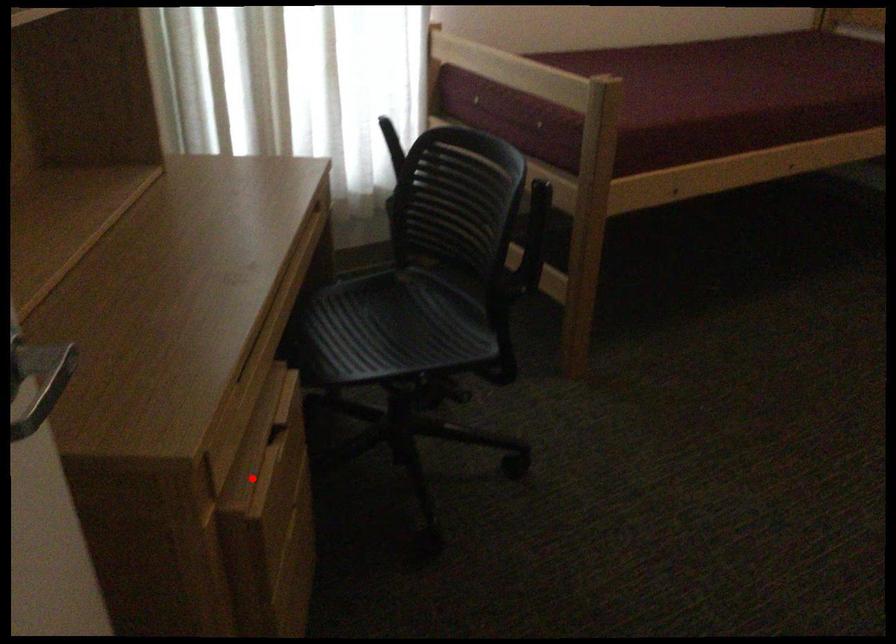
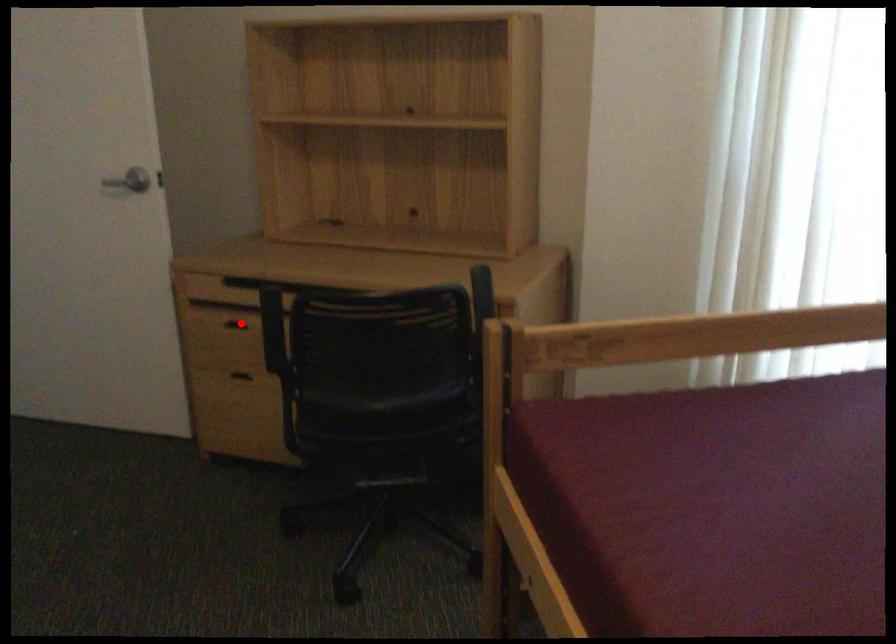
I am providing you with two images of the same scene from different viewpoints. A red point is marked on the first image and another point is marked on the second image. Does the point marked in image1 correspond to the same location as the one in image2?

Yes